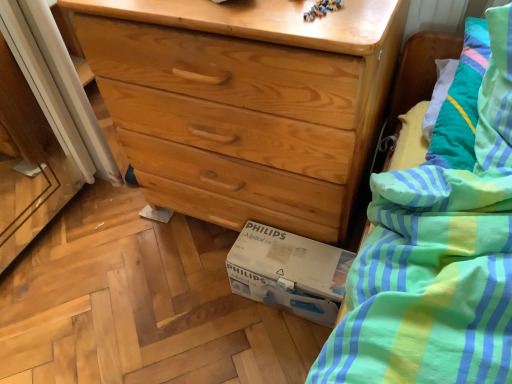
What do you see at coordinates (289, 272) in the screenshot?
I see `white cardboard box at lower center` at bounding box center [289, 272].

Where is `white cardboard box at lower center`? white cardboard box at lower center is located at coordinates (289, 272).

What is the approximate height of white cardboard box at lower center?

It is 6.77 inches.

From the picture: What is the approximate height of natural wood chest of drawers at center?

The height of natural wood chest of drawers at center is 67.31 centimeters.

The image size is (512, 384). What do you see at coordinates (245, 103) in the screenshot?
I see `natural wood chest of drawers at center` at bounding box center [245, 103].

Locate an element on the screen. Image resolution: width=512 pixels, height=384 pixels. natural wood chest of drawers at center is located at coordinates (245, 103).

The width and height of the screenshot is (512, 384). Identify the location of white cardboard box at lower center. (289, 272).

Considering the relative positions of white cardboard box at lower center and natural wood chest of drawers at center in the image provided, is white cardboard box at lower center to the right of natural wood chest of drawers at center from the viewer's perspective?

Correct, you'll find white cardboard box at lower center to the right of natural wood chest of drawers at center.

Which object is more forward, white cardboard box at lower center or natural wood chest of drawers at center?

natural wood chest of drawers at center is in front.

Is point (316, 292) farther from camera compared to point (194, 102)?

Yes, it is.

From the image's perspective, is white cardboard box at lower center above or below natural wood chest of drawers at center?

From the image's perspective, white cardboard box at lower center appears below natural wood chest of drawers at center.

From a real-world perspective, is white cardboard box at lower center physically located above or below natural wood chest of drawers at center?

white cardboard box at lower center is below natural wood chest of drawers at center.

Can you confirm if white cardboard box at lower center is wider than natural wood chest of drawers at center?

Incorrect, the width of white cardboard box at lower center does not surpass that of natural wood chest of drawers at center.

Considering the sizes of objects white cardboard box at lower center and natural wood chest of drawers at center in the image provided, who is taller, white cardboard box at lower center or natural wood chest of drawers at center?

natural wood chest of drawers at center is taller.

Can you confirm if white cardboard box at lower center is smaller than natural wood chest of drawers at center?

Indeed, white cardboard box at lower center has a smaller size compared to natural wood chest of drawers at center.

Looking at this image, is white cardboard box at lower center outside of natural wood chest of drawers at center?

Yes.

From the picture: Is white cardboard box at lower center positioned far away from natural wood chest of drawers at center?

No.

From the picture: Is white cardboard box at lower center oriented towards natural wood chest of drawers at center?

No, white cardboard box at lower center is not aimed at natural wood chest of drawers at center.

Measure the distance between white cardboard box at lower center and natural wood chest of drawers at center.

The distance of white cardboard box at lower center from natural wood chest of drawers at center is 10.34 inches.

Find the location of a particular element. cardboard box located underneath the natural wood chest of drawers at center (from a real-world perspective) is located at coordinates (289, 272).

Is natural wood chest of drawers at center to the right of white cardboard box at lower center from the viewer's perspective?

No.

Considering the relative positions of natural wood chest of drawers at center and white cardboard box at lower center in the image provided, is natural wood chest of drawers at center in front of white cardboard box at lower center?

Yes, the depth of natural wood chest of drawers at center is less than that of white cardboard box at lower center.

Is point (136, 21) closer or farther from the camera than point (276, 280)?

Point (136, 21) is closer to the camera than point (276, 280).

From the image's perspective, does natural wood chest of drawers at center appear higher than white cardboard box at lower center?

Indeed, from the image's perspective, natural wood chest of drawers at center is shown above white cardboard box at lower center.

From a real-world perspective, who is located higher, natural wood chest of drawers at center or white cardboard box at lower center?

In real-world perspective, natural wood chest of drawers at center is above.

Considering the sizes of natural wood chest of drawers at center and white cardboard box at lower center in the image, is natural wood chest of drawers at center wider or thinner than white cardboard box at lower center?

In the image, natural wood chest of drawers at center appears to be wider than white cardboard box at lower center.

Considering the relative sizes of natural wood chest of drawers at center and white cardboard box at lower center in the image provided, is natural wood chest of drawers at center taller than white cardboard box at lower center?

Yes, natural wood chest of drawers at center is taller than white cardboard box at lower center.

Based on their sizes in the image, would you say natural wood chest of drawers at center is bigger or smaller than white cardboard box at lower center?

Considering their sizes, natural wood chest of drawers at center takes up more space than white cardboard box at lower center.

Would you say white cardboard box at lower center is part of natural wood chest of drawers at center's contents?

No, white cardboard box at lower center is located outside of natural wood chest of drawers at center.

Is natural wood chest of drawers at center in contact with white cardboard box at lower center?

natural wood chest of drawers at center and white cardboard box at lower center are clearly separated.

Could you tell me if natural wood chest of drawers at center is turned towards white cardboard box at lower center?

Yes, natural wood chest of drawers at center is facing white cardboard box at lower center.

Where is `chest of drawers in front of the white cardboard box at lower center`? The image size is (512, 384). chest of drawers in front of the white cardboard box at lower center is located at coordinates [x=245, y=103].

The image size is (512, 384). In order to click on the chest of drawers above the white cardboard box at lower center (from the image's perspective) in this screenshot , I will do `click(245, 103)`.

Locate an element on the screen. This screenshot has width=512, height=384. chest of drawers on the left of white cardboard box at lower center is located at coordinates (245, 103).